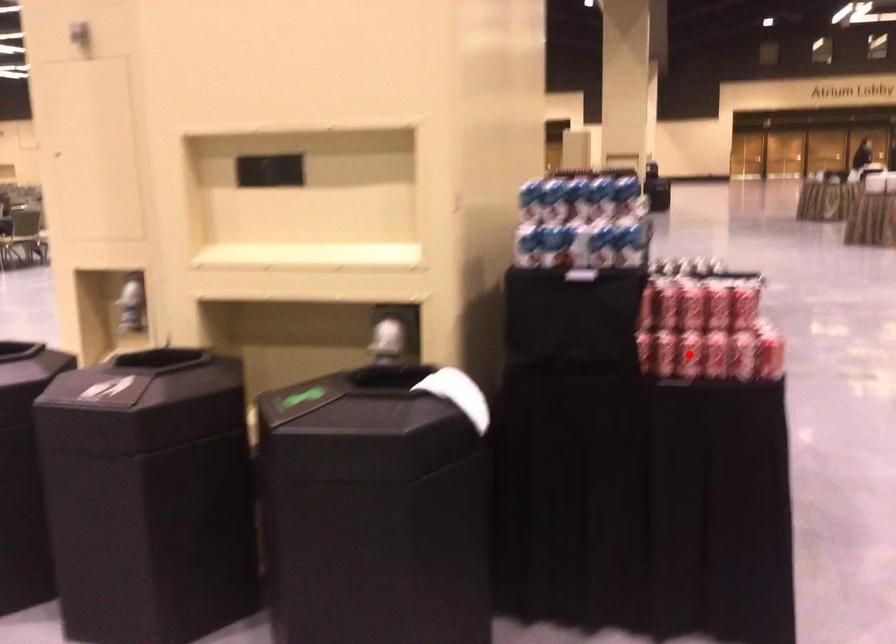
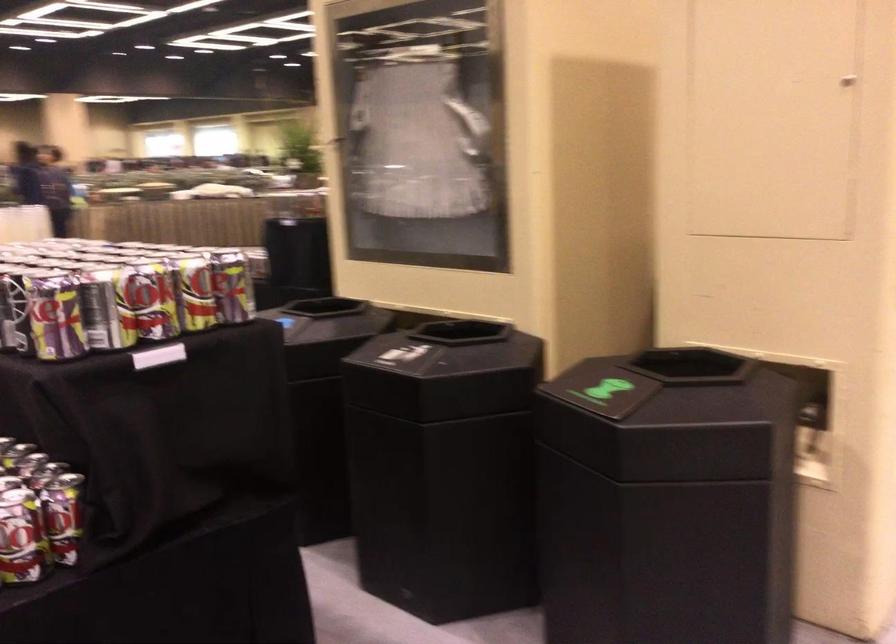
Question: I am providing you with two images of the same scene from different viewpoints. A red point is marked on the first image. Is the red point's position out of view in image 2?

Choices:
 (A) Yes
 (B) No

Answer: (A)